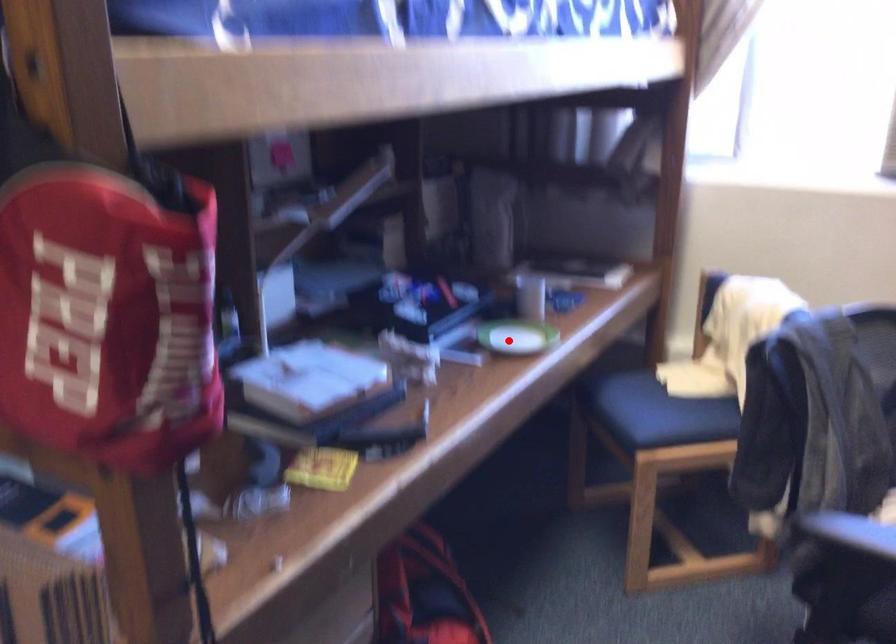
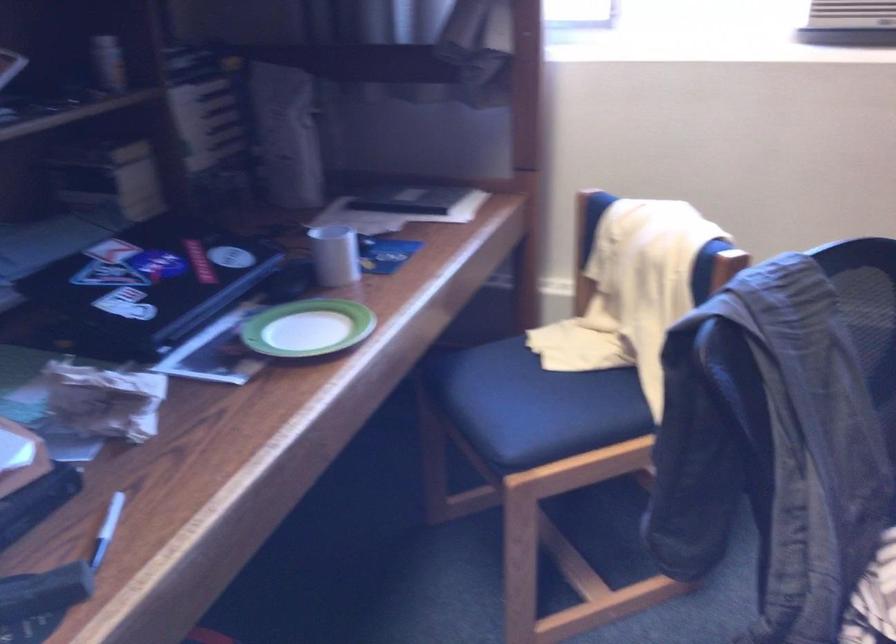
Question: I am providing you with two images of the same scene from different viewpoints. Given a red point in image1, look at the same physical point in image2. Is it:

Choices:
 (A) Closer to the viewpoint
 (B) Farther from the viewpoint

Answer: (A)